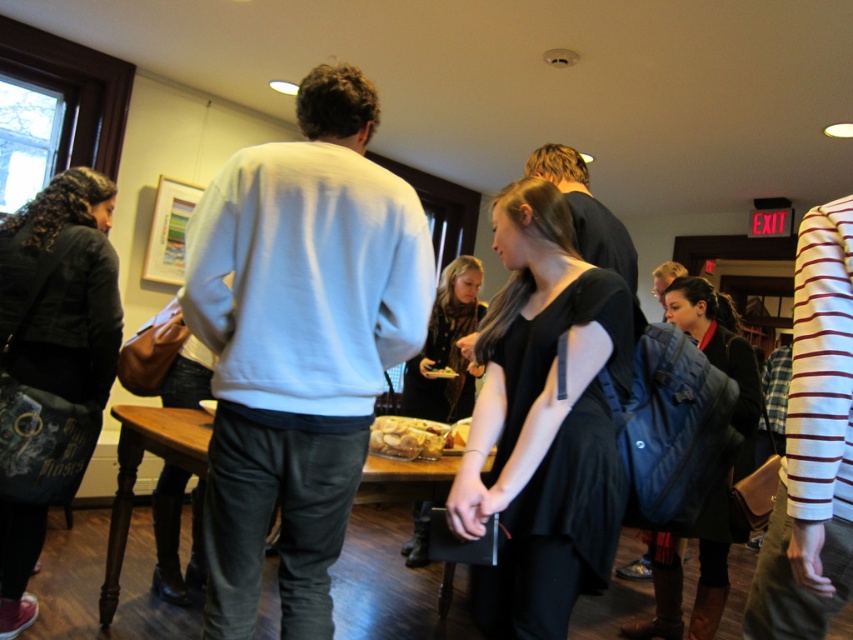
You are at a party and want to place a small gift on the wooden table at center. However, there is a dark green fabric jacket at left in the way. Can you move the jacket to access the table?

The wooden table at center is behind the dark green fabric jacket at left, so you can move the dark green fabric jacket at left to access the wooden table at center.

You are at a party and want to borrow a jacket from the dark green fabric jacket at left and the wooden table at center. Which object can you take?

The dark green fabric jacket at left can be taken as it is a wearable item, while the wooden table at center is a stationary object and cannot be moved.

You are standing at the center of the room and want to greet the person wearing the white striped shirt at right. In which general direction should you move to approach them?

The white striped shirt at right is located at point 0.697 on the x and 0.953 on the y axis, so you should move to the right and slightly forward to reach them.